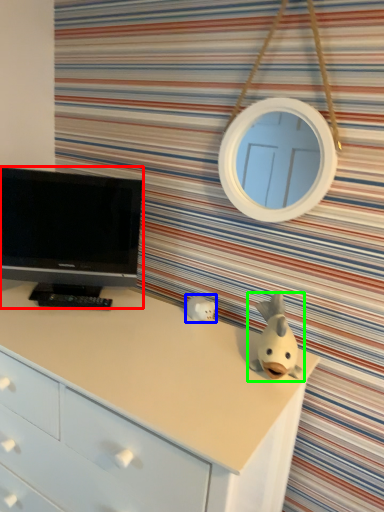
Question: Which is farther away from television (highlighted by a red box)? toy (highlighted by a blue box) or toy (highlighted by a green box)?

Choices:
 (A) toy
 (B) toy

Answer: (B)